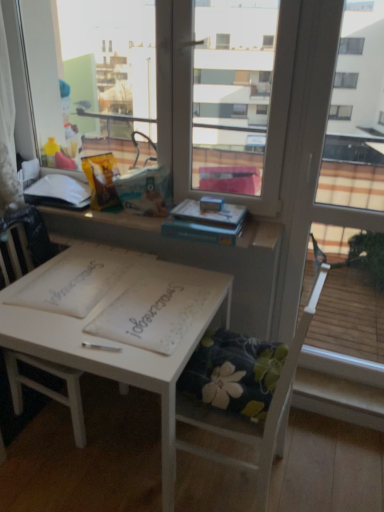
In order to click on vacant space behind white paper notebook at center, which is the 1th notebook from right to left in this screenshot , I will do `click(140, 269)`.